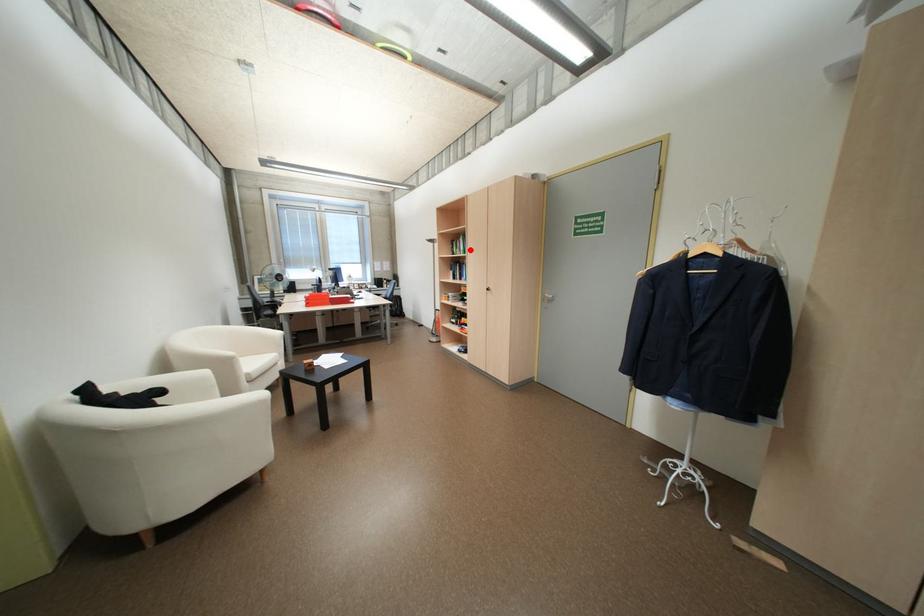
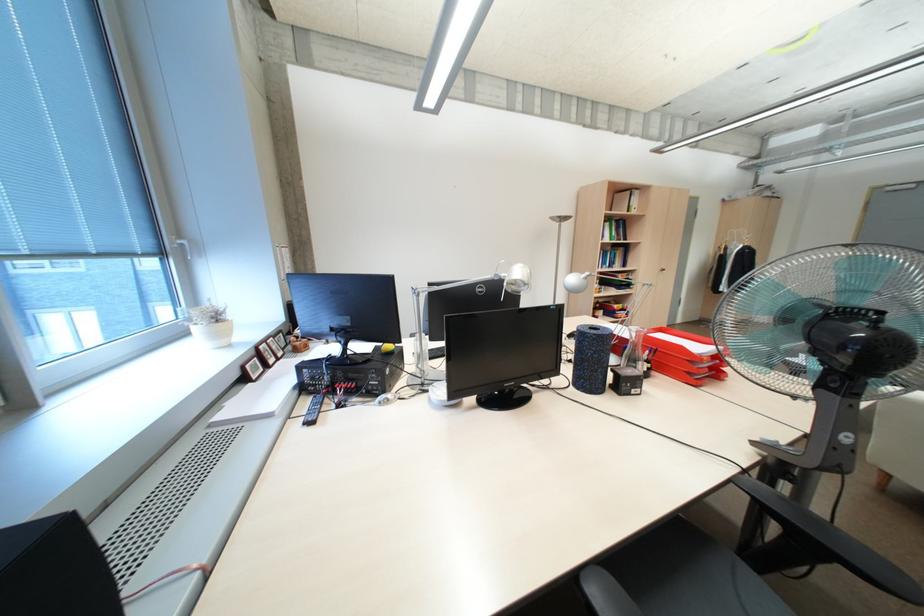
Question: I am providing you with two images of the same scene from different viewpoints. A red point is marked on the first image. Is the red point's position out of view in image 2?

Choices:
 (A) Yes
 (B) No

Answer: (B)